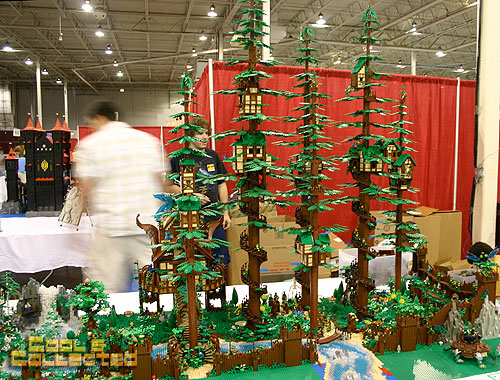
Find the location of a particular element. Image resolution: width=500 pixels, height=380 pixels. red curtains hanging from frame below ceiling is located at coordinates (200, 90), (391, 85).